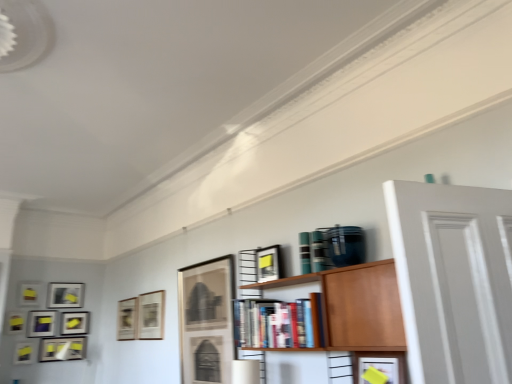
Question: Should I look upward or downward to see matte black picture frame at center, which ranks as the eleventh picture frame in left-to-right order?

Choices:
 (A) down
 (B) up

Answer: (A)

Question: Is matte black picture frame at lower left, which ranks as the ninth picture frame in right-to-left order, facing towards hardcover books at center?

Choices:
 (A) yes
 (B) no

Answer: (A)

Question: Can you confirm if matte black picture frame at lower left, which appears as the 3th picture frame when viewed from the left, is shorter than hardcover books at center?

Choices:
 (A) yes
 (B) no

Answer: (A)

Question: From the image's perspective, would you say matte black picture frame at lower left, which appears as the 3th picture frame when viewed from the left, is shown under hardcover books at center?

Choices:
 (A) no
 (B) yes

Answer: (B)

Question: From a real-world perspective, is matte black picture frame at lower left, which ranks as the ninth picture frame in right-to-left order, over hardcover books at center?

Choices:
 (A) yes
 (B) no

Answer: (B)

Question: Is matte black picture frame at lower left, which appears as the 3th picture frame when viewed from the left, closer to the viewer compared to hardcover books at center?

Choices:
 (A) yes
 (B) no

Answer: (B)

Question: Is matte black picture frame at lower left, which appears as the 3th picture frame when viewed from the left, not close to hardcover books at center?

Choices:
 (A) no
 (B) yes

Answer: (B)

Question: Is matte black picture frame at left, which is the 5th picture frame in left-to-right order, turned away from matte black picture frame at lower left, which appears as the eighth picture frame when viewed from the right?

Choices:
 (A) no
 (B) yes

Answer: (A)

Question: Does matte black picture frame at left, which is the 5th picture frame in left-to-right order, turn towards matte black picture frame at lower left, positioned as the 4th picture frame in left-to-right order?

Choices:
 (A) no
 (B) yes

Answer: (A)

Question: From the image's perspective, is matte black picture frame at left, positioned as the seventh picture frame in right-to-left order, located above matte black picture frame at lower left, positioned as the 4th picture frame in left-to-right order?

Choices:
 (A) no
 (B) yes

Answer: (B)

Question: Is matte black picture frame at left, positioned as the seventh picture frame in right-to-left order, positioned beyond the bounds of matte black picture frame at lower left, positioned as the 4th picture frame in left-to-right order?

Choices:
 (A) no
 (B) yes

Answer: (B)

Question: Is the depth of matte black picture frame at left, positioned as the seventh picture frame in right-to-left order, greater than that of matte black picture frame at lower left, which appears as the eighth picture frame when viewed from the right?

Choices:
 (A) no
 (B) yes

Answer: (B)

Question: Considering the relative sizes of matte black picture frame at left, positioned as the seventh picture frame in right-to-left order, and matte black picture frame at lower left, positioned as the 4th picture frame in left-to-right order, in the image provided, is matte black picture frame at left, positioned as the seventh picture frame in right-to-left order, shorter than matte black picture frame at lower left, positioned as the 4th picture frame in left-to-right order,?

Choices:
 (A) no
 (B) yes

Answer: (A)

Question: Would you say matte black picture frame at center, the 9th picture frame in the left-to-right sequence, is outside matte black picture frame at lower left, which appears as the 3th picture frame when viewed from the left?

Choices:
 (A) yes
 (B) no

Answer: (A)